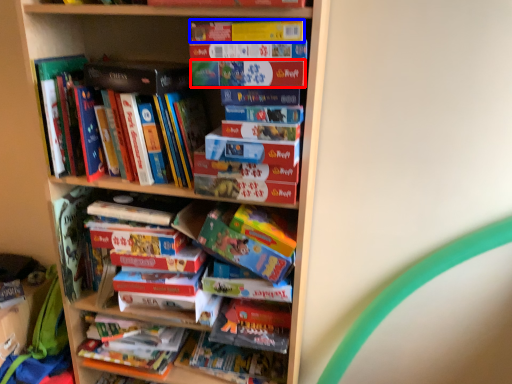
Question: Which object is closer to the camera taking this photo, paperback book (highlighted by a red box) or paperback book (highlighted by a blue box)?

Choices:
 (A) paperback book
 (B) paperback book

Answer: (B)